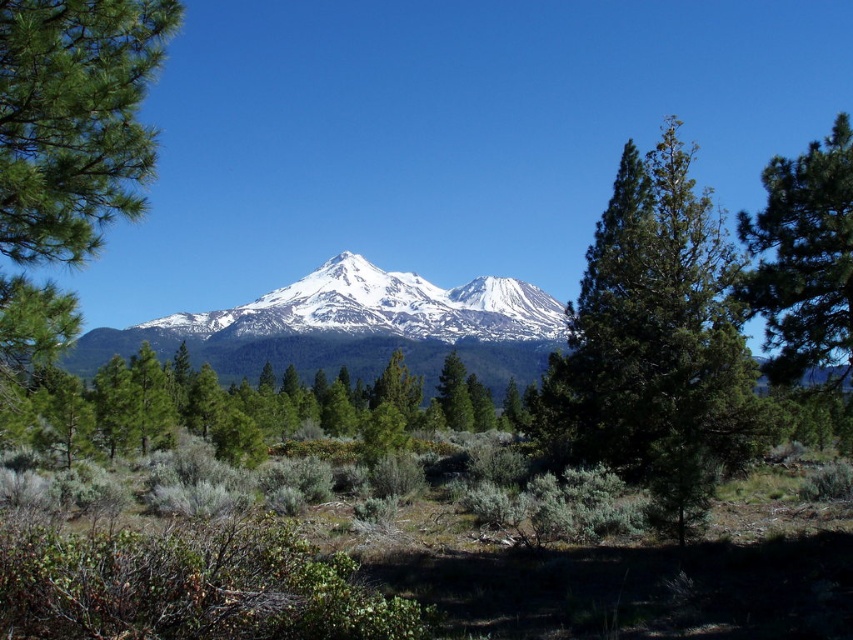
Between green textured tree at center and green textured pine tree at right, which one is positioned higher?

green textured tree at center is higher up.

Is point (688, 506) positioned behind point (848, 292)?

That is False.

Where is `green textured tree at center`? green textured tree at center is located at coordinates (654, 340).

Between white snow-covered mountain range at center and green matte tree at center, which one has more height?

white snow-covered mountain range at center

Does white snow-covered mountain range at center have a lesser height compared to green matte tree at center?

Incorrect, white snow-covered mountain range at center's height does not fall short of green matte tree at center's.

Find the location of a particular element. The width and height of the screenshot is (853, 640). white snow-covered mountain range at center is located at coordinates (354, 326).

Does point (560, 369) come farther from viewer compared to point (228, 408)?

No, (560, 369) is closer to viewer.

Is green textured tree at center wider than green matte tree at center?

Incorrect, green textured tree at center's width does not surpass green matte tree at center's.

The height and width of the screenshot is (640, 853). Identify the location of green textured tree at center. (654, 340).